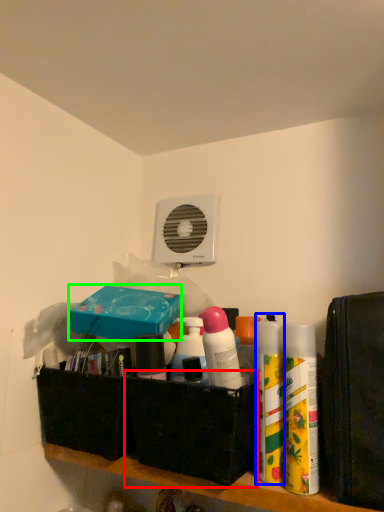
Question: Which object is the closest to the box (highlighted by a red box)? Choose among these: cleaning product (highlighted by a blue box) or box (highlighted by a green box).

Choices:
 (A) cleaning product
 (B) box

Answer: (A)